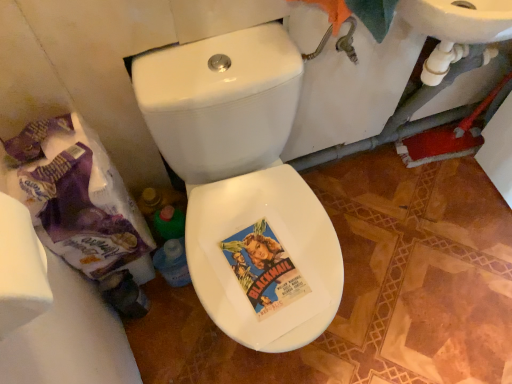
What is the approximate height of white glossy bidet at center?

It is 0.53 inches.

Measure the distance between white glossy toilet at center and camera.

A distance of 33.38 inches exists between white glossy toilet at center and camera.

Where is `white glossy bidet at center`? This screenshot has width=512, height=384. white glossy bidet at center is located at coordinates (280, 243).

In the scene shown: From a real-world perspective, which is physically below, white glossy toilet at center or white matte toilet paper at left?

From a 3D spatial view, white glossy toilet at center is below.

Is white matte toilet paper at left a part of white glossy toilet at center?

Actually, white matte toilet paper at left is outside white glossy toilet at center.

Looking at the image, does white glossy toilet at center seem bigger or smaller compared to white matte toilet paper at left?

Considering their sizes, white glossy toilet at center takes up more space than white matte toilet paper at left.

Are white glossy toilet at center and white matte toilet paper at left far apart?

No, white glossy toilet at center is not far from white matte toilet paper at left.

Looking at their sizes, would you say white glossy bidet at center is wider or thinner than white glossy toilet at center?

Clearly, white glossy bidet at center has less width compared to white glossy toilet at center.

Is white glossy bidet at center not inside white glossy toilet at center?

No, white glossy bidet at center is inside or overlapping with white glossy toilet at center.

Between white glossy bidet at center and white glossy toilet at center, which one has larger size?

With larger size is white glossy toilet at center.

From a real-world perspective, which object rests below the other?

white glossy toilet at center, from a real-world perspective.

From a real-world perspective, is white matte toilet paper at left positioned under white glossy bidet at center based on gravity?

No, from a real-world perspective, white matte toilet paper at left is not below white glossy bidet at center.

Between white matte toilet paper at left and white glossy bidet at center, which one appears on the right side from the viewer's perspective?

Positioned to the right is white glossy bidet at center.

From the image's perspective, is white matte toilet paper at left located above or below white glossy bidet at center?

From the image's perspective, white matte toilet paper at left appears above white glossy bidet at center.

Which is closer to the camera, [26,296] or [297,313]?

The point [26,296] is more forward.

Based on the photo, is white glossy bidet at center positioned beyond the bounds of white matte toilet paper at left?

Indeed, white glossy bidet at center is completely outside white matte toilet paper at left.

Is white glossy bidet at center further to the viewer compared to white matte toilet paper at left?

Yes.

Can you confirm if white glossy bidet at center is bigger than white matte toilet paper at left?

Incorrect, white glossy bidet at center is not larger than white matte toilet paper at left.

Which object is thinner, white matte toilet paper at left or white glossy toilet at center?

white matte toilet paper at left is thinner.

From a real-world perspective, is white matte toilet paper at left on top of white glossy toilet at center?

Yes, from a real-world perspective, white matte toilet paper at left is above white glossy toilet at center.

Is white matte toilet paper at left taller than white glossy toilet at center?

In fact, white matte toilet paper at left may be shorter than white glossy toilet at center.

Is white glossy toilet at center located within white matte toilet paper at left?

No, white matte toilet paper at left does not contain white glossy toilet at center.

In the scene shown: Which is more to the left, white glossy toilet at center or white glossy bidet at center?

white glossy toilet at center.

Locate an element on the screen. toilet lying on the left of white glossy bidet at center is located at coordinates (244, 184).

From a real-world perspective, does white glossy toilet at center sit lower than white glossy bidet at center?

Yes, from a real-world perspective, white glossy toilet at center is beneath white glossy bidet at center.

Can white glossy bidet at center be found inside white glossy toilet at center?

Yes, white glossy bidet at center is a part of white glossy toilet at center.

This screenshot has height=384, width=512. In order to click on toilet beneath the white matte toilet paper at left (from a real-world perspective) in this screenshot , I will do `click(244, 184)`.

You are a GUI agent. You are given a task and a screenshot of the screen. Output one action in this format:
    pyautogui.click(x=<x>, y=<y>)
    Task: Click on the toilet lying above the white glossy bidet at center (from the image's perspective)
    
    Given the screenshot: What is the action you would take?
    pyautogui.click(x=244, y=184)

Based on their spatial positions, is white glossy bidet at center or white glossy toilet at center closer to white matte toilet paper at left?

white glossy toilet at center.

Considering their positions, is white glossy toilet at center positioned closer to white glossy bidet at center than white matte toilet paper at left?

white glossy toilet at center is positioned closer to the anchor white glossy bidet at center.

From the picture: When comparing their distances from white matte toilet paper at left, does white glossy toilet at center or white glossy bidet at center seem closer?

white glossy toilet at center.

Which object lies nearer to the anchor point white glossy bidet at center, white matte toilet paper at left or white glossy toilet at center?

white glossy toilet at center.

Which object lies nearer to the anchor point white glossy toilet at center, white matte toilet paper at left or white glossy bidet at center?

white glossy bidet at center lies closer to white glossy toilet at center than the other object.

Estimate the real-world distances between objects in this image. Which object is closer to white glossy toilet at center, white glossy bidet at center or white matte toilet paper at left?

Among the two, white glossy bidet at center is located nearer to white glossy toilet at center.

This screenshot has height=384, width=512. In order to click on toilet between white matte toilet paper at left and white glossy bidet at center in the front-back direction in this screenshot , I will do `click(244, 184)`.